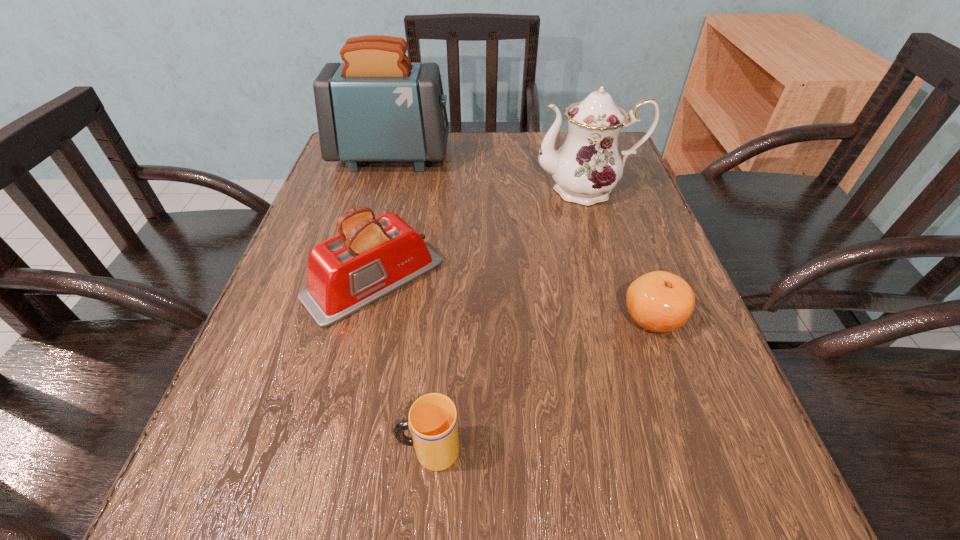
At what (x,y) coordinates should I click in order to perform the action: click on free location that satisfies the following two spatial constraints: 1. on the front-facing side of the fourth shortest object; 2. on the right side of the taller toaster. Please return your answer as a coordinate pair (x, y). This screenshot has width=960, height=540. Looking at the image, I should click on (382, 190).